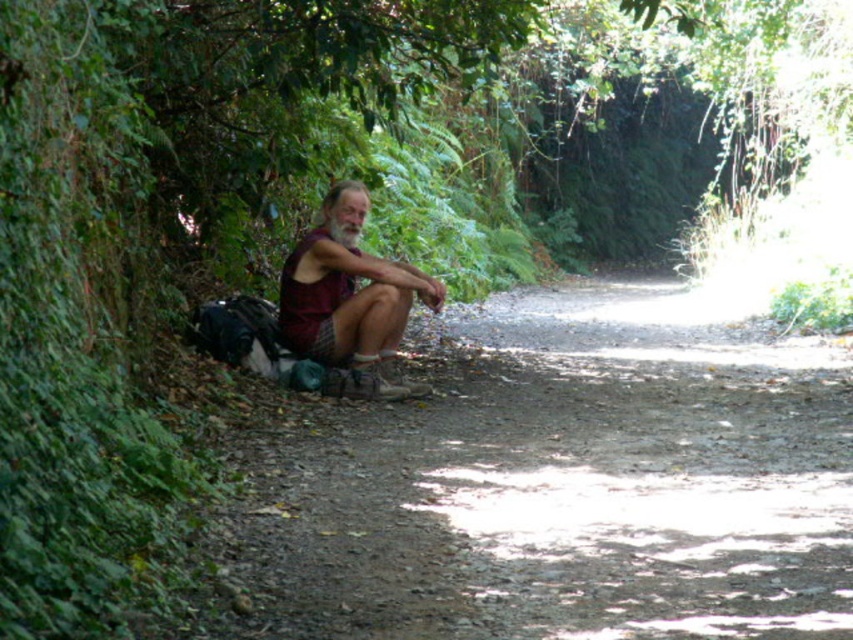
Which is below, dirt path at left or maroon fabric shirt at center?

dirt path at left is below.

Does point (430, 625) lie in front of point (305, 241)?

Yes, it is in front of point (305, 241).

Identify the location of dirt path at left. (566, 486).